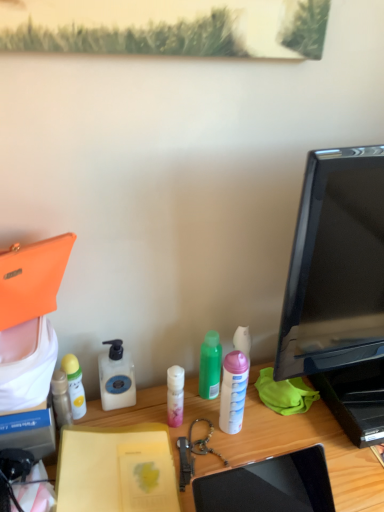
Identify the location of vacant space in between translucent plastic bottle at left, the 5th bottle when ordered from right to left, and green matte bottle at center, placed as the fourth bottle when sorted from left to right. (146, 410).